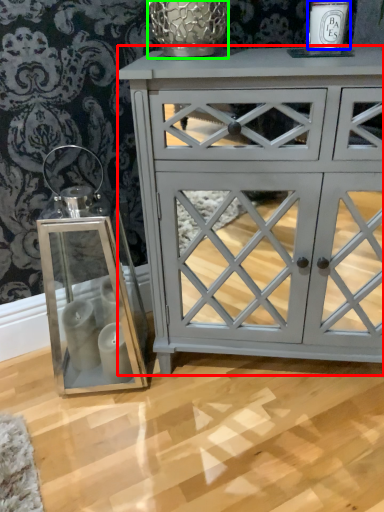
Question: Considering the real-world distances, which object is farthest from chest of drawers (highlighted by a red box)? candle holder (highlighted by a blue box) or glass vase (highlighted by a green box)?

Choices:
 (A) candle holder
 (B) glass vase

Answer: (A)